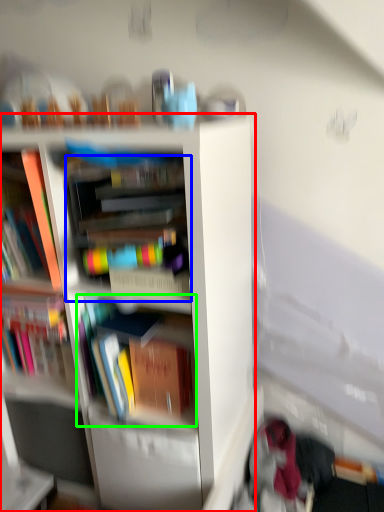
Question: Based on their relative distances, which object is farther from bookcase (highlighted by a red box)? Choose from book (highlighted by a blue box) and book (highlighted by a green box).

Choices:
 (A) book
 (B) book

Answer: (A)